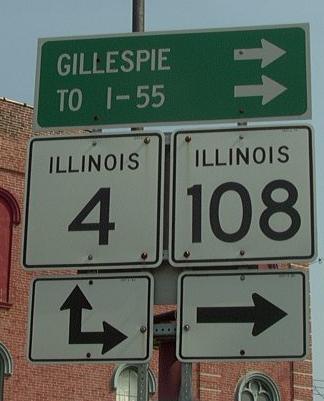
Identify the location of red window. (5, 266).